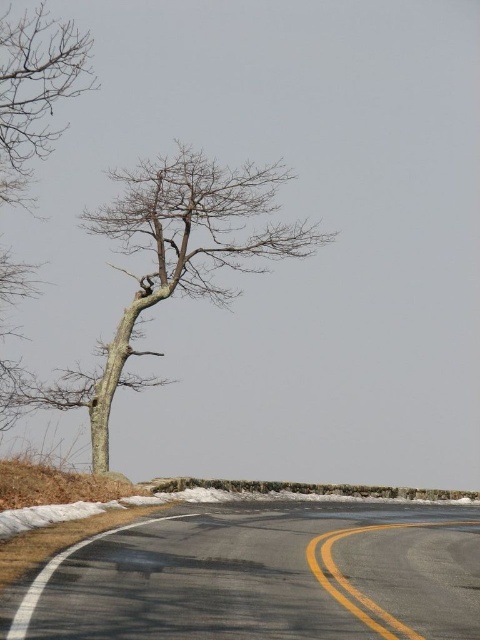
Between black asphalt road at lower center and yellow asphalt at lower center, which one has less height?

yellow asphalt at lower center is shorter.

From the picture: Is black asphalt road at lower center shorter than yellow asphalt at lower center?

No, black asphalt road at lower center is not shorter than yellow asphalt at lower center.

Who is more forward, (394, 584) or (359, 600)?

Point (359, 600)

The width and height of the screenshot is (480, 640). I want to click on black asphalt road at lower center, so click(264, 577).

Can you confirm if bare branches at upper left is positioned to the left of yellow asphalt at lower center?

Yes, bare branches at upper left is to the left of yellow asphalt at lower center.

From the picture: Is bare branches at upper left wider than yellow asphalt at lower center?

In fact, bare branches at upper left might be narrower than yellow asphalt at lower center.

Does point (17, 49) come farther from viewer compared to point (321, 554)?

Yes.

Locate an element on the screen. bare branches at upper left is located at coordinates (35, 90).

Who is positioned more to the left, black asphalt road at lower center or bare branches at upper left?

bare branches at upper left

Which is behind, point (405, 596) or point (21, 150)?

Point (21, 150)

I want to click on black asphalt road at lower center, so click(264, 577).